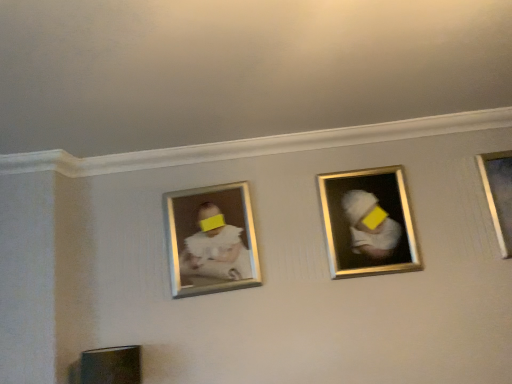
Question: Is white matte baby portrait at center bigger or smaller than metallic silver picture frame at right, positioned as the first picture frame in right-to-left order?

Choices:
 (A) small
 (B) big

Answer: (B)

Question: From their relative heights in the image, would you say white matte baby portrait at center is taller or shorter than metallic silver picture frame at right, arranged as the second picture frame when viewed from the left?

Choices:
 (A) tall
 (B) short

Answer: (A)

Question: Which is farther from the white matte baby portrait at center?

Choices:
 (A) metallic silver picture frame at right, arranged as the second picture frame when viewed from the left
 (B) gold metallic picture frame at center, arranged as the 1th picture frame when viewed from the left

Answer: (A)

Question: Estimate the real-world distances between objects in this image. Which object is closer to the metallic silver picture frame at right, arranged as the second picture frame when viewed from the left?

Choices:
 (A) gold metallic picture frame at center, the 2th picture frame in the right-to-left sequence
 (B) white matte baby portrait at center

Answer: (A)